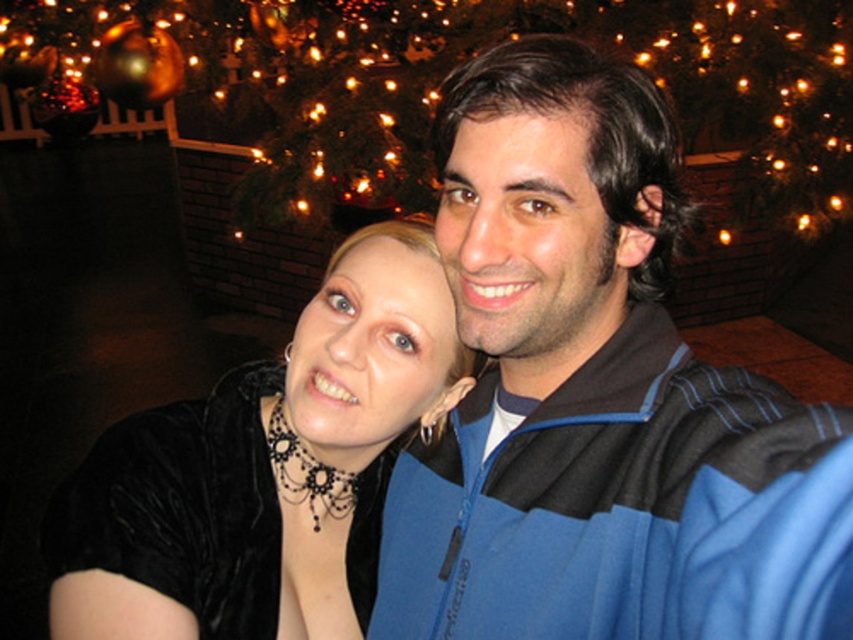
Does velvet black dress at center come behind metallic gold ornament at upper center?

No.

Between velvet black dress at center and metallic gold ornament at upper center, which one appears on the right side from the viewer's perspective?

metallic gold ornament at upper center is more to the right.

Measure the distance between velvet black dress at center and camera.

velvet black dress at center is 25.78 inches away from camera.

Identify the location of velvet black dress at center. This screenshot has height=640, width=853. (265, 468).